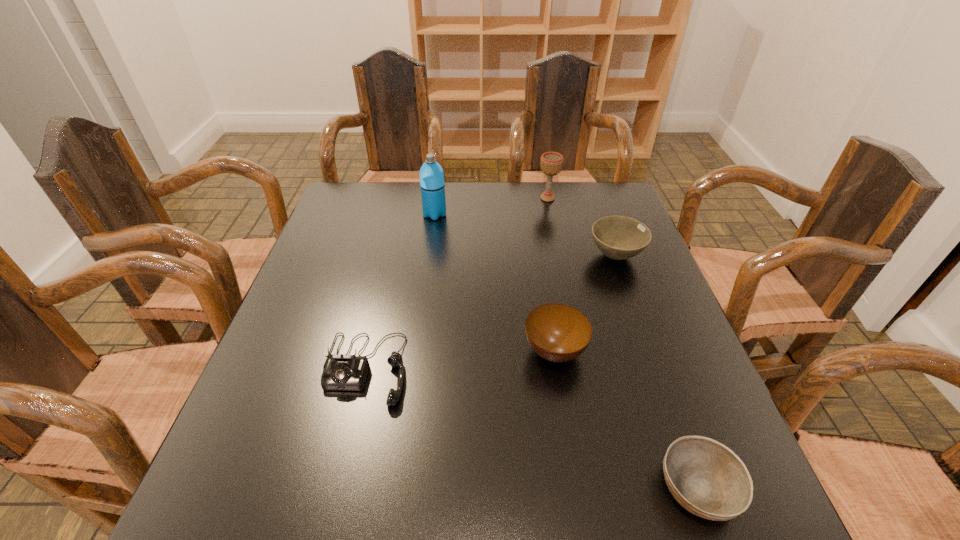
Find the location of a particular element. This screenshot has height=540, width=960. vacant area located on the left of the fifth shortest object is located at coordinates (425, 198).

Image resolution: width=960 pixels, height=540 pixels. What are the coordinates of `free location located on the front of the third farthest object` in the screenshot? It's located at (637, 316).

Where is `blank space located 0.130m on the front of the leftmost bowl`? The width and height of the screenshot is (960, 540). blank space located 0.130m on the front of the leftmost bowl is located at coordinates pos(568,436).

Image resolution: width=960 pixels, height=540 pixels. Identify the location of vacant area situated 0.200m on the dial of the telephone. (329, 521).

Find the location of a particular element. The width and height of the screenshot is (960, 540). free region located 0.220m on the left of the nearest bowl is located at coordinates (529, 487).

Where is `thermos bottle at the far edge`? thermos bottle at the far edge is located at coordinates (432, 185).

This screenshot has height=540, width=960. Find the location of `chalice that is at the far edge`. chalice that is at the far edge is located at coordinates (551, 164).

The width and height of the screenshot is (960, 540). Identify the location of object at the near edge. (708, 479).

At what (x,y) coordinates should I click in order to perform the action: click on object at the left edge. Please return your answer as a coordinate pair (x, y). Looking at the image, I should click on (345, 372).

Image resolution: width=960 pixels, height=540 pixels. Identify the location of object present at the near right corner. (708, 479).